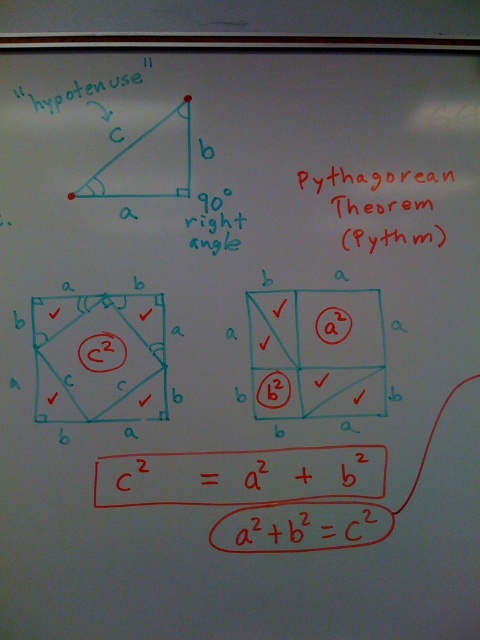
You are a student trying to copy the Pythagorean Theorem from the whiteboard. You notice two elements on the board. The first is the red matte Pythagorean theorem at upper right, and the second is the blue marker text at center. Which one should you focus on to ensure you copy the theorem accurately?

You should focus on the red matte Pythagorean theorem at upper right because it is larger than the blue marker text at center, making it easier to read and copy accurately.

Where is the matte blue square at center located on the whiteboard?

The matte blue square at center is located at point (99, 356) on the whiteboard.